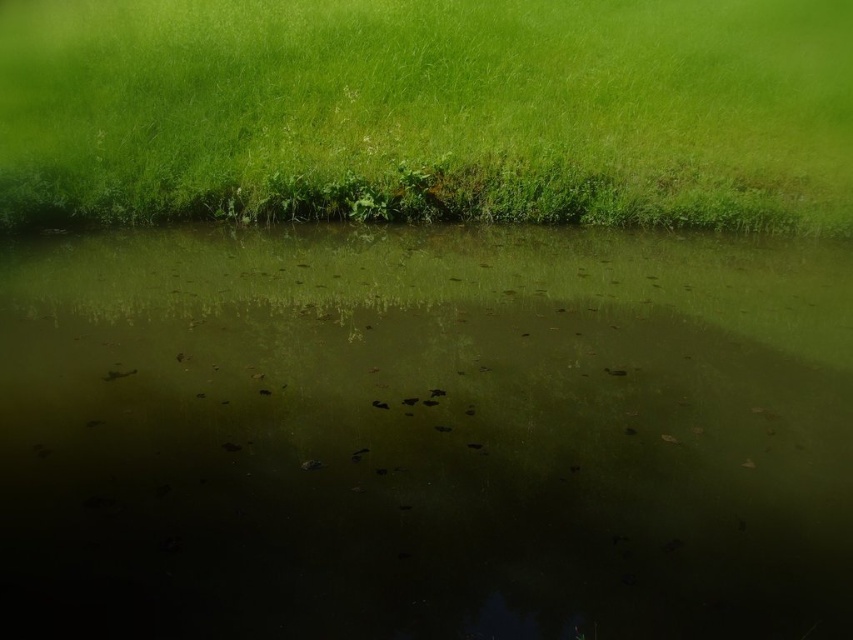
Question: Observing the image, what is the correct spatial positioning of green murky water at center in reference to green grassy at upper center?

Choices:
 (A) right
 (B) left

Answer: (A)

Question: Which object appears farthest from the camera in this image?

Choices:
 (A) green murky water at center
 (B) green grassy at upper center

Answer: (B)

Question: Is green murky water at center bigger than green grassy at upper center?

Choices:
 (A) no
 (B) yes

Answer: (A)

Question: In this image, where is green murky water at center located relative to green grassy at upper center?

Choices:
 (A) right
 (B) left

Answer: (A)

Question: Which of the following is the farthest from the observer?

Choices:
 (A) (704, 586)
 (B) (35, 76)

Answer: (B)